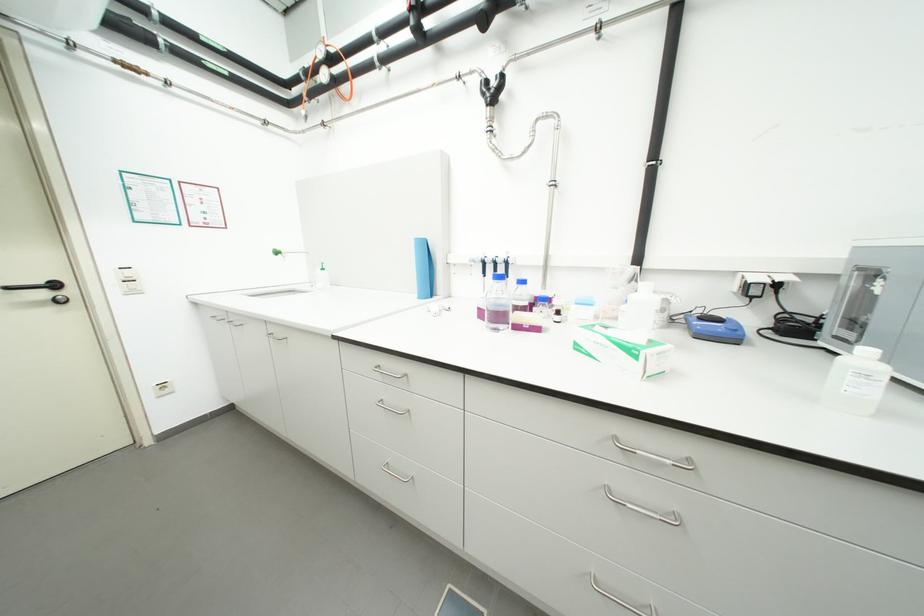
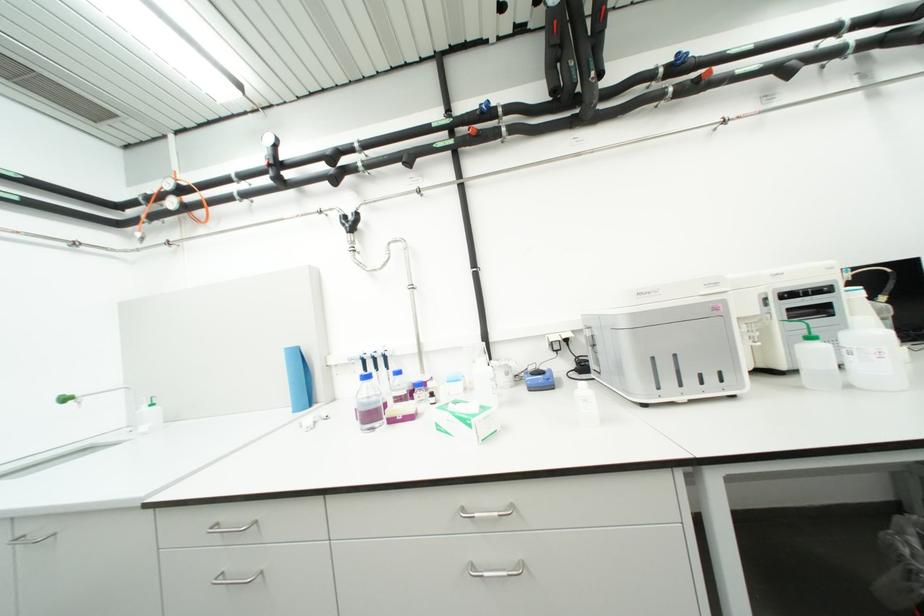
The point at (385, 368) is marked in the first image. Where is the corresponding point in the second image?

(224, 525)